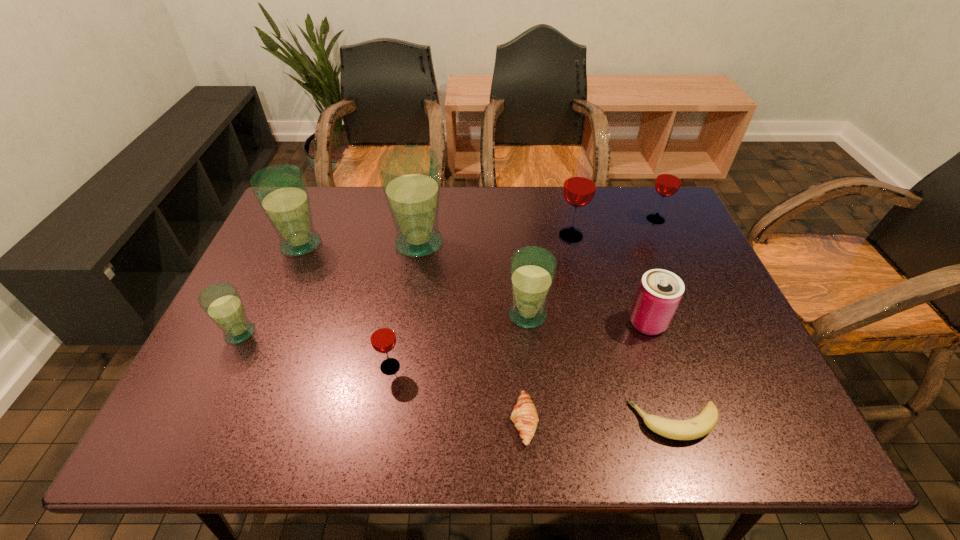
The height and width of the screenshot is (540, 960). I want to click on the eighth farthest object, so click(383, 339).

Find the location of a particular element. The width and height of the screenshot is (960, 540). the nearest red glass is located at coordinates (383, 339).

The height and width of the screenshot is (540, 960). What are the coordinates of `the smallest blue glass` in the screenshot? It's located at (221, 301).

At what (x,y) coordinates should I click in order to perform the action: click on pastry. Please return your answer as a coordinate pair (x, y). This screenshot has height=540, width=960. Looking at the image, I should click on (525, 417).

Locate an element on the screen. banana is located at coordinates (699, 426).

Find the location of a particular element. The width and height of the screenshot is (960, 540). the shortest object is located at coordinates (699, 426).

Identify the location of vacant region located 0.220m on the right of the biggest blue glass. The height and width of the screenshot is (540, 960). (522, 243).

The height and width of the screenshot is (540, 960). I want to click on vacant space located 0.230m on the right of the biggest red glass, so click(664, 235).

The height and width of the screenshot is (540, 960). In order to click on vacant space located on the right of the third smallest blue glass in this screenshot , I will do `click(435, 244)`.

Locate an element on the screen. The width and height of the screenshot is (960, 540). vacant space situated on the left of the second smallest red glass is located at coordinates (628, 219).